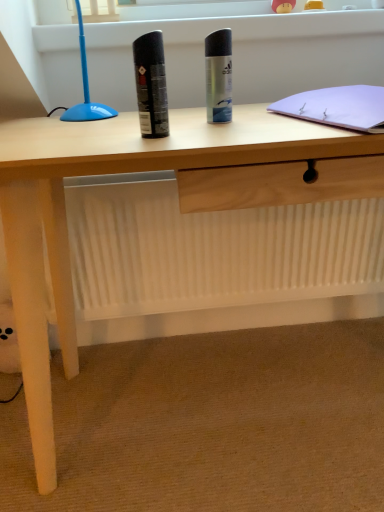
What do you see at coordinates (338, 106) in the screenshot?
I see `white paper notebook at upper right` at bounding box center [338, 106].

What do you see at coordinates (151, 85) in the screenshot?
I see `black matte can at center, positioned as the first stationery in left-to-right order` at bounding box center [151, 85].

In order to face black matte can at center, positioned as the first stationery in left-to-right order, should I rotate leftwards or rightwards?

To align with it, rotate left about 6.219°.

I want to click on silver metallic deodorant can at center, which is the first stationery from back to front, so click(218, 76).

Is white paper notebook at upper right next to silver metallic deodorant can at center, which is the first stationery from back to front, and touching it?

No.

Considering the relative sizes of white paper notebook at upper right and silver metallic deodorant can at center, which is the first stationery from back to front, in the image provided, is white paper notebook at upper right smaller than silver metallic deodorant can at center, which is the first stationery from back to front,?

No, white paper notebook at upper right is not smaller than silver metallic deodorant can at center, which is the first stationery from back to front.

Considering the relative sizes of white paper notebook at upper right and silver metallic deodorant can at center, arranged as the first stationery when viewed from the right, in the image provided, is white paper notebook at upper right wider than silver metallic deodorant can at center, arranged as the first stationery when viewed from the right,?

Indeed, white paper notebook at upper right has a greater width compared to silver metallic deodorant can at center, arranged as the first stationery when viewed from the right.

Considering the sizes of white paper notebook at upper right and black matte can at center, positioned as the first stationery in left-to-right order, in the image, is white paper notebook at upper right wider or thinner than black matte can at center, positioned as the first stationery in left-to-right order,?

Considering their sizes, white paper notebook at upper right looks broader than black matte can at center, positioned as the first stationery in left-to-right order.

Which is nearer, (288, 99) or (141, 81)?

Point (141, 81)

Is white paper notebook at upper right not inside black matte can at center, the 2th stationery viewed from the back?

Yes, white paper notebook at upper right is not within black matte can at center, the 2th stationery viewed from the back.

Does white paper notebook at upper right have a smaller size compared to black matte can at center, the 2th stationery viewed from the back?

Incorrect, white paper notebook at upper right is not smaller in size than black matte can at center, the 2th stationery viewed from the back.

How many degrees apart are the facing directions of silver metallic deodorant can at center, the 2th stationery in the left-to-right sequence, and white paper notebook at upper right?

There is a 12.9-degree angle between the facing directions of silver metallic deodorant can at center, the 2th stationery in the left-to-right sequence, and white paper notebook at upper right.

Is silver metallic deodorant can at center, the 2th stationery in the left-to-right sequence, turned away from white paper notebook at upper right?

silver metallic deodorant can at center, the 2th stationery in the left-to-right sequence, does not have its back to white paper notebook at upper right.

Which point is more distant from viewer, (219,104) or (304,108)?

The point (219,104) is behind.

Between silver metallic deodorant can at center, which is the first stationery from back to front, and white paper notebook at upper right, which one has more height?

Standing taller between the two is silver metallic deodorant can at center, which is the first stationery from back to front.

Between silver metallic deodorant can at center, arranged as the first stationery when viewed from the right, and black matte can at center, positioned as the first stationery in left-to-right order, which one appears on the left side from the viewer's perspective?

From the viewer's perspective, black matte can at center, positioned as the first stationery in left-to-right order, appears more on the left side.

I want to click on stationery below the black matte can at center, positioned as the first stationery in left-to-right order (from a real-world perspective), so click(x=218, y=76).

Is silver metallic deodorant can at center, arranged as the first stationery when viewed from the right, outside of black matte can at center, the 2th stationery viewed from the back?

Yes, silver metallic deodorant can at center, arranged as the first stationery when viewed from the right, is outside of black matte can at center, the 2th stationery viewed from the back.

Is silver metallic deodorant can at center, which is the first stationery from back to front, facing towards black matte can at center, marked as the second stationery in a right-to-left arrangement?

No, silver metallic deodorant can at center, which is the first stationery from back to front, is not facing towards black matte can at center, marked as the second stationery in a right-to-left arrangement.

Is black matte can at center, the 2th stationery viewed from the back, wider or thinner than silver metallic deodorant can at center, arranged as the first stationery when viewed from the right?

In the image, black matte can at center, the 2th stationery viewed from the back, appears to be more narrow than silver metallic deodorant can at center, arranged as the first stationery when viewed from the right.

How many degrees apart are the facing directions of black matte can at center, marked as the second stationery in a right-to-left arrangement, and silver metallic deodorant can at center, arranged as the first stationery when viewed from the right?

The angular difference between black matte can at center, marked as the second stationery in a right-to-left arrangement, and silver metallic deodorant can at center, arranged as the first stationery when viewed from the right, is 0.00419 degrees.

Could you measure the distance between black matte can at center, the 2th stationery viewed from the back, and silver metallic deodorant can at center, the 2th stationery in the left-to-right sequence?

black matte can at center, the 2th stationery viewed from the back, is 4.94 inches from silver metallic deodorant can at center, the 2th stationery in the left-to-right sequence.

From a real-world perspective, is black matte can at center, the 2th stationery viewed from the back, over silver metallic deodorant can at center, the 2th stationery in the left-to-right sequence?

Yes, from a real-world perspective, black matte can at center, the 2th stationery viewed from the back, is over silver metallic deodorant can at center, the 2th stationery in the left-to-right sequence

From their relative heights in the image, would you say black matte can at center, which is the first stationery in front-to-back order, is taller or shorter than white paper notebook at upper right?

black matte can at center, which is the first stationery in front-to-back order, is taller than white paper notebook at upper right.

Is black matte can at center, which is the first stationery in front-to-back order, bigger or smaller than white paper notebook at upper right?

Considering their sizes, black matte can at center, which is the first stationery in front-to-back order, takes up less space than white paper notebook at upper right.

Would you say black matte can at center, which is the first stationery in front-to-back order, is to the left or to the right of white paper notebook at upper right in the picture?

In the image, black matte can at center, which is the first stationery in front-to-back order, appears on the left side of white paper notebook at upper right.

At what (x,y) coordinates should I click in order to perform the action: click on notebook below the silver metallic deodorant can at center, arranged as the second stationery when viewed from the front (from the image's perspective). Please return your answer as a coordinate pair (x, y). The image size is (384, 512). Looking at the image, I should click on (338, 106).

You are a GUI agent. You are given a task and a screenshot of the screen. Output one action in this format:
    pyautogui.click(x=<x>, y=<y>)
    Task: Click on the 1st stationery behind the white paper notebook at upper right, counting from the anchor's position
    
    Given the screenshot: What is the action you would take?
    pyautogui.click(x=151, y=85)

Based on their spatial positions, is white paper notebook at upper right or black matte can at center, positioned as the first stationery in left-to-right order, further from silver metallic deodorant can at center, arranged as the first stationery when viewed from the right?

Based on the image, white paper notebook at upper right appears to be further to silver metallic deodorant can at center, arranged as the first stationery when viewed from the right.

From the image, which object appears to be farther from silver metallic deodorant can at center, the 2th stationery in the left-to-right sequence, black matte can at center, marked as the second stationery in a right-to-left arrangement, or white paper notebook at upper right?

white paper notebook at upper right is positioned further to the anchor silver metallic deodorant can at center, the 2th stationery in the left-to-right sequence.

From the image, which object appears to be nearer to black matte can at center, the 2th stationery viewed from the back, white paper notebook at upper right or silver metallic deodorant can at center, the 2th stationery in the left-to-right sequence?

The object closer to black matte can at center, the 2th stationery viewed from the back, is silver metallic deodorant can at center, the 2th stationery in the left-to-right sequence.

Which object lies further to the anchor point white paper notebook at upper right, black matte can at center, which is the first stationery in front-to-back order, or silver metallic deodorant can at center, arranged as the second stationery when viewed from the front?

black matte can at center, which is the first stationery in front-to-back order, is further to white paper notebook at upper right.

Based on their spatial positions, is silver metallic deodorant can at center, arranged as the second stationery when viewed from the front, or black matte can at center, marked as the second stationery in a right-to-left arrangement, closer to white paper notebook at upper right?

silver metallic deodorant can at center, arranged as the second stationery when viewed from the front.

Looking at the image, which one is located further to black matte can at center, marked as the second stationery in a right-to-left arrangement, silver metallic deodorant can at center, the 2th stationery in the left-to-right sequence, or white paper notebook at upper right?

white paper notebook at upper right is further to black matte can at center, marked as the second stationery in a right-to-left arrangement.

Identify the location of stationery situated between black matte can at center, which is the first stationery in front-to-back order, and white paper notebook at upper right from left to right. The image size is (384, 512). (218, 76).